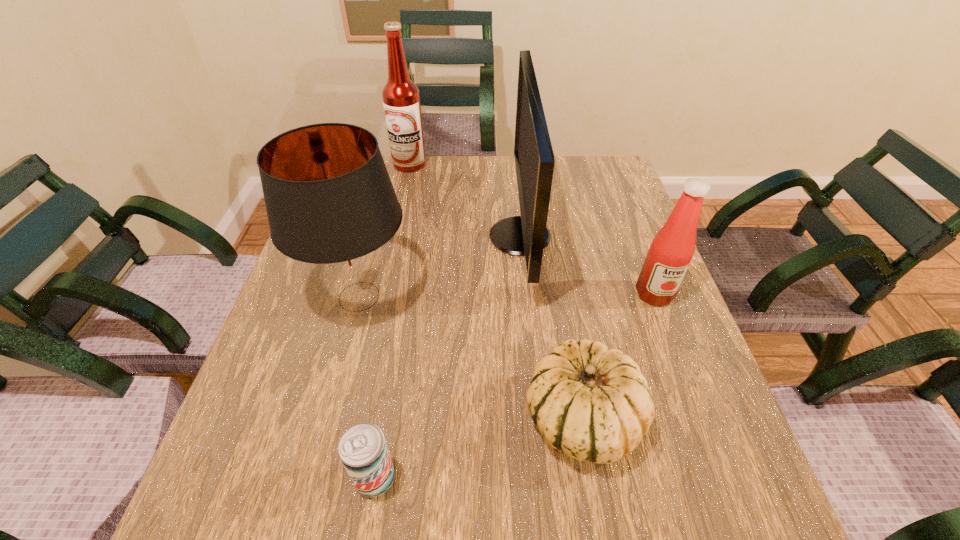
I want to click on free region that satisfies the following two spatial constraints: 1. on the front-facing side of the computer monitor; 2. on the front side of the lampshade, so click(526, 296).

Identify the location of vacant area in the image that satisfies the following two spatial constraints: 1. on the front-facing side of the computer monitor; 2. on the back side of the fifth tallest object. (539, 420).

Locate an element on the screen. blank area in the image that satisfies the following two spatial constraints: 1. on the back side of the gourd; 2. on the left side of the shortest object is located at coordinates (384, 420).